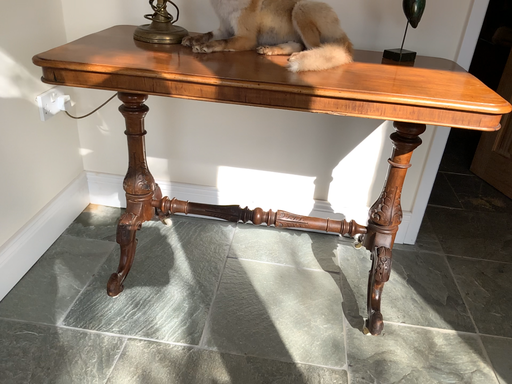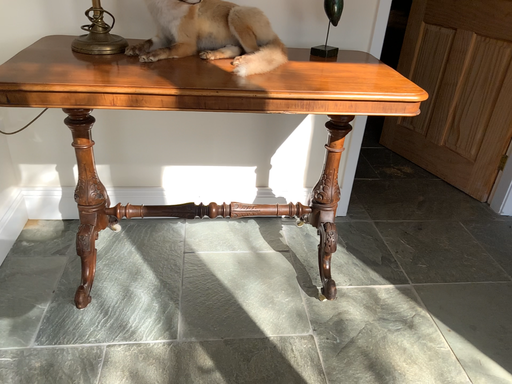
Question: How did the camera likely rotate when shooting the video?

Choices:
 (A) rotated right
 (B) rotated left

Answer: (A)